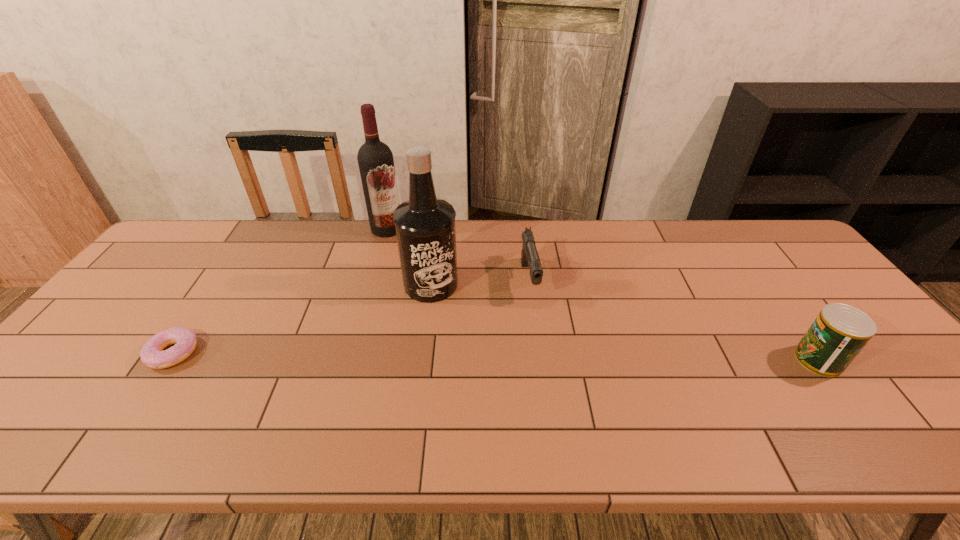
Where is `object present at the right edge`? object present at the right edge is located at coordinates (838, 334).

Where is `vacant space at the far edge of the desktop`? This screenshot has height=540, width=960. vacant space at the far edge of the desktop is located at coordinates (316, 242).

The image size is (960, 540). I want to click on vacant region at the near edge of the desktop, so click(x=385, y=411).

Where is `free space at the left edge of the desktop`? Image resolution: width=960 pixels, height=540 pixels. free space at the left edge of the desktop is located at coordinates (125, 307).

The width and height of the screenshot is (960, 540). Identify the location of free space at the near right corner of the desktop. (874, 382).

The image size is (960, 540). What are the coordinates of `vacant area between the doughnut and the liquor` in the screenshot? It's located at (302, 319).

Image resolution: width=960 pixels, height=540 pixels. Identify the location of empty space that is in between the can and the shortest object. (495, 356).

Where is `empty space that is in between the third object from left to right and the second object from right to left`? The height and width of the screenshot is (540, 960). empty space that is in between the third object from left to right and the second object from right to left is located at coordinates (480, 282).

Where is `free space between the can and the fourth object from left to right`? free space between the can and the fourth object from left to right is located at coordinates (674, 320).

In order to click on unoccupied position between the third object from left to right and the gun in this screenshot , I will do `click(480, 282)`.